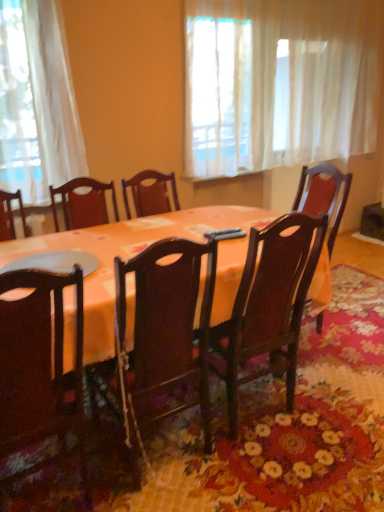
Image resolution: width=384 pixels, height=512 pixels. In order to click on white sheer curtain at upper center in this screenshot , I will do point(276,82).

What do you see at coordinates (276, 82) in the screenshot? The image size is (384, 512). I see `white sheer curtain at upper center` at bounding box center [276, 82].

Find the location of a particular element. This screenshot has width=384, height=512. black plastic remote control at center is located at coordinates (225, 234).

From a real-world perspective, is matte dark wood chair at lower left, the 1th chair viewed from the left, above or below black plastic remote control at center?

Clearly, from a real-world perspective, matte dark wood chair at lower left, the 1th chair viewed from the left, is below black plastic remote control at center.

Considering the relative sizes of matte dark wood chair at lower left, the 1th chair viewed from the left, and black plastic remote control at center in the image provided, is matte dark wood chair at lower left, the 1th chair viewed from the left, thinner than black plastic remote control at center?

Incorrect, the width of matte dark wood chair at lower left, the 1th chair viewed from the left, is not less than that of black plastic remote control at center.

Considering the sizes of objects matte dark wood chair at lower left, the 1th chair viewed from the left, and black plastic remote control at center in the image provided, who is bigger, matte dark wood chair at lower left, the 1th chair viewed from the left, or black plastic remote control at center?

With larger size is matte dark wood chair at lower left, the 1th chair viewed from the left.

Is matte dark wood chair at lower left, the second chair in the right-to-left sequence, far away from black plastic remote control at center?

No, there isn't a large distance between matte dark wood chair at lower left, the second chair in the right-to-left sequence, and black plastic remote control at center.

Is orange fabric table at center aimed at matte dark wood chair at lower left, the second chair in the right-to-left sequence?

Yes, orange fabric table at center is turned towards matte dark wood chair at lower left, the second chair in the right-to-left sequence.

Is orange fabric table at center to the left of matte dark wood chair at lower left, the 1th chair viewed from the left, from the viewer's perspective?

No.

From a real-world perspective, which is physically above, orange fabric table at center or matte dark wood chair at lower left, the second chair in the right-to-left sequence?

matte dark wood chair at lower left, the second chair in the right-to-left sequence, from a real-world perspective.

Is there a large distance between orange fabric table at center and matte dark wood chair at lower left, the 1th chair viewed from the left?

No, orange fabric table at center is not far away from matte dark wood chair at lower left, the 1th chair viewed from the left.

Can we say orange fabric table at center lies outside white sheer curtain at upper center?

orange fabric table at center is positioned outside white sheer curtain at upper center.

Is point (73, 303) behind point (288, 82)?

No, (73, 303) is in front of (288, 82).

From a real-world perspective, who is located higher, orange fabric table at center or white sheer curtain at upper center?

In real-world perspective, white sheer curtain at upper center is above.

Is orange fabric table at center to the right of white sheer curtain at upper center from the viewer's perspective?

Incorrect, orange fabric table at center is not on the right side of white sheer curtain at upper center.

Is black plastic remote control at center inside the boundaries of white sheer curtain at upper center, or outside?

black plastic remote control at center is spatially situated outside white sheer curtain at upper center.

Which object is more forward, black plastic remote control at center or white sheer curtain at upper center?

black plastic remote control at center.

From a real-world perspective, is black plastic remote control at center physically above white sheer curtain at upper center?

No, from a real-world perspective, black plastic remote control at center is not over white sheer curtain at upper center

Is black plastic remote control at center directly adjacent to white sheer curtain at upper center?

No, black plastic remote control at center is not next to white sheer curtain at upper center.

From the image's perspective, who appears lower, orange fabric table at center or wooden chair at center, positioned as the second chair in left-to-right order?

orange fabric table at center is shown below in the image.

Does orange fabric table at center turn towards wooden chair at center, which ranks as the 1th chair in right-to-left order?

Yes, orange fabric table at center faces towards wooden chair at center, which ranks as the 1th chair in right-to-left order.

Between orange fabric table at center and wooden chair at center, which ranks as the 1th chair in right-to-left order, which one has less height?

With less height is orange fabric table at center.

Does point (4, 255) appear closer or farther from the camera than point (271, 338)?

Point (4, 255) appears to be farther away from the viewer than point (271, 338).

Between white sheer curtain at upper center and orange fabric table at center, which one has smaller width?

Thinner between the two is white sheer curtain at upper center.

From a real-world perspective, is white sheer curtain at upper center positioned over orange fabric table at center based on gravity?

Yes.

Considering the relative positions of white sheer curtain at upper center and orange fabric table at center in the image provided, is white sheer curtain at upper center to the left or to the right of orange fabric table at center?

white sheer curtain at upper center is to the right of orange fabric table at center.

Looking at this image, in the image, is wooden chair at center, which ranks as the 1th chair in right-to-left order, positioned in front of or behind orange fabric table at center?

wooden chair at center, which ranks as the 1th chair in right-to-left order, is positioned farther from the viewer than orange fabric table at center.

From the image's perspective, between wooden chair at center, which ranks as the 1th chair in right-to-left order, and orange fabric table at center, which one is located above?

From the image's view, wooden chair at center, which ranks as the 1th chair in right-to-left order, is above.

Considering the sizes of wooden chair at center, positioned as the second chair in left-to-right order, and orange fabric table at center in the image, is wooden chair at center, positioned as the second chair in left-to-right order, wider or thinner than orange fabric table at center?

Considering their sizes, wooden chair at center, positioned as the second chair in left-to-right order, looks slimmer than orange fabric table at center.

Between wooden chair at center, which ranks as the 1th chair in right-to-left order, and orange fabric table at center, which one appears on the left side from the viewer's perspective?

From the viewer's perspective, orange fabric table at center appears more on the left side.

Find the location of `chair that is the 2nd one when counting downward from the black plastic remote control at center (from the image's perspective)`. chair that is the 2nd one when counting downward from the black plastic remote control at center (from the image's perspective) is located at coordinates (40, 369).

Locate an element on the screen. kitchen & dining room table that is above the matte dark wood chair at lower left, the second chair in the right-to-left sequence (from the image's perspective) is located at coordinates tap(139, 252).

Which object lies further to the anchor point wooden chair at center, which ranks as the 1th chair in right-to-left order, white sheer curtain at upper center or matte dark wood chair at lower left, the second chair in the right-to-left sequence?

white sheer curtain at upper center is positioned further to the anchor wooden chair at center, which ranks as the 1th chair in right-to-left order.

Estimate the real-world distances between objects in this image. Which object is closer to orange fabric table at center, wooden chair at center, positioned as the second chair in left-to-right order, or white sheer curtain at upper center?

The object closer to orange fabric table at center is wooden chair at center, positioned as the second chair in left-to-right order.

Based on the photo, considering their positions, is white sheer curtain at upper center positioned further to black plastic remote control at center than wooden chair at center, which ranks as the 1th chair in right-to-left order?

white sheer curtain at upper center is positioned further to the anchor black plastic remote control at center.

Estimate the real-world distances between objects in this image. Which object is closer to matte dark wood chair at lower left, the 1th chair viewed from the left, black plastic remote control at center or wooden chair at center, which ranks as the 1th chair in right-to-left order?

black plastic remote control at center is closer to matte dark wood chair at lower left, the 1th chair viewed from the left.

From the image, which object appears to be nearer to white sheer curtain at upper center, matte dark wood chair at lower left, the second chair in the right-to-left sequence, or wooden chair at center, positioned as the second chair in left-to-right order?

wooden chair at center, positioned as the second chair in left-to-right order, is positioned closer to the anchor white sheer curtain at upper center.

When comparing their distances from white sheer curtain at upper center, does orange fabric table at center or black plastic remote control at center seem closer?

orange fabric table at center.

When comparing their distances from wooden chair at center, positioned as the second chair in left-to-right order, does white sheer curtain at upper center or orange fabric table at center seem closer?

orange fabric table at center is closer to wooden chair at center, positioned as the second chair in left-to-right order.

Looking at the image, which one is located further to matte dark wood chair at lower left, the second chair in the right-to-left sequence, wooden chair at center, positioned as the second chair in left-to-right order, or white sheer curtain at upper center?

white sheer curtain at upper center is positioned further to the anchor matte dark wood chair at lower left, the second chair in the right-to-left sequence.

The height and width of the screenshot is (512, 384). I want to click on kitchen & dining room table between matte dark wood chair at lower left, the 1th chair viewed from the left, and wooden chair at center, which ranks as the 1th chair in right-to-left order, in the horizontal direction, so 139,252.

Locate an element on the screen. remote control between white sheer curtain at upper center and wooden chair at center, positioned as the second chair in left-to-right order, in the vertical direction is located at coordinates (225, 234).

At what (x,y) coordinates should I click in order to perform the action: click on chair between white sheer curtain at upper center and orange fabric table at center vertically. Please return your answer as a coordinate pair (x, y). The height and width of the screenshot is (512, 384). Looking at the image, I should click on (269, 305).

Image resolution: width=384 pixels, height=512 pixels. Identify the location of kitchen & dining room table between matte dark wood chair at lower left, the 1th chair viewed from the left, and black plastic remote control at center from front to back. [x=139, y=252].